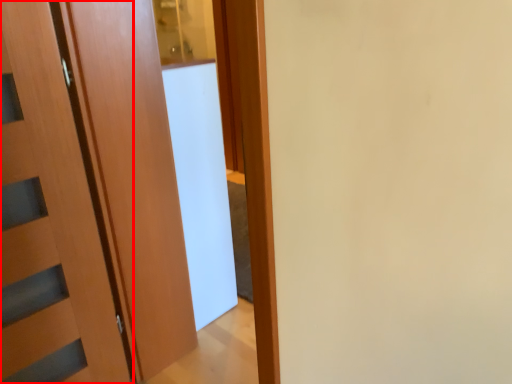
Question: From the image's perspective, what is the correct spatial relationship of door (annotated by the red box) in relation to screen door?

Choices:
 (A) below
 (B) above

Answer: (A)